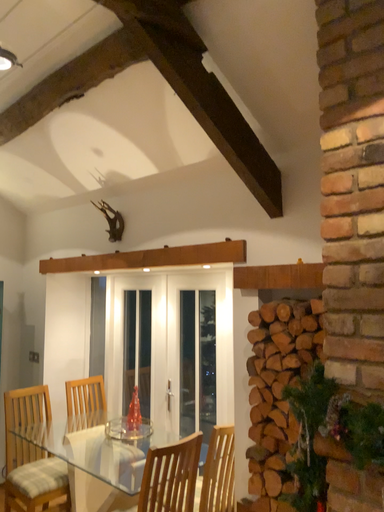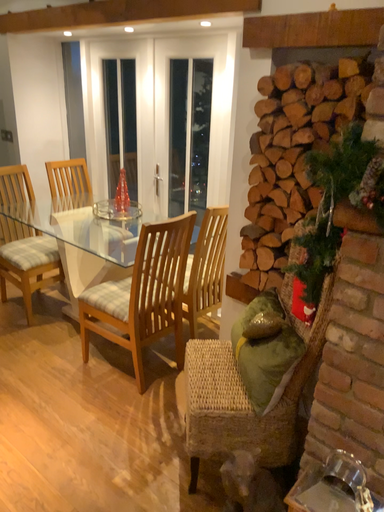
Question: How did the camera likely rotate when shooting the video?

Choices:
 (A) rotated upward
 (B) rotated downward

Answer: (B)